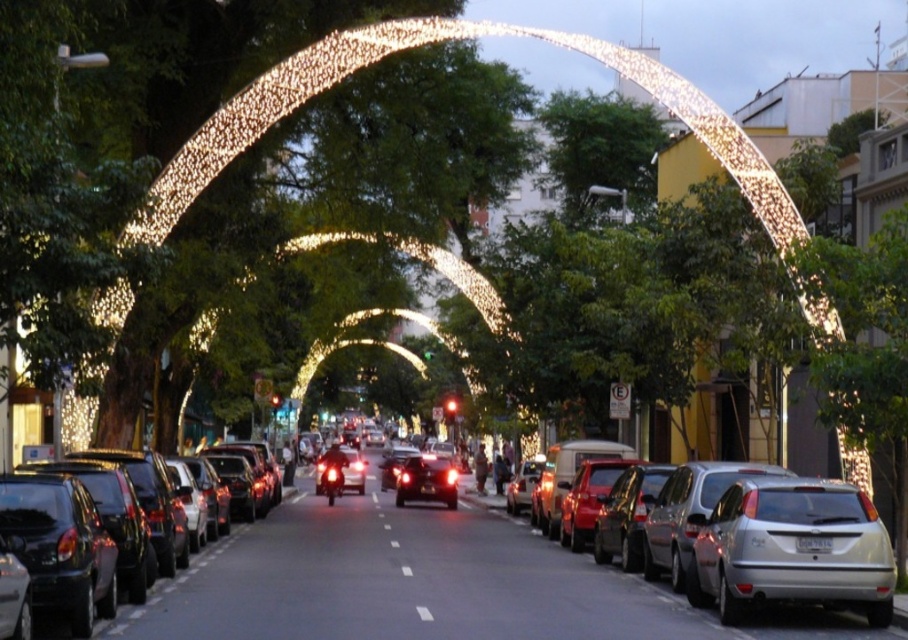
Question: Is the position of silver metallic sedan at center-right more distant than that of white dotted line at center?

Choices:
 (A) no
 (B) yes

Answer: (A)

Question: Observing the image, what is the correct spatial positioning of illuminated fabric arch at center in reference to white dotted line at center?

Choices:
 (A) right
 (B) left

Answer: (A)

Question: Is illuminated fabric arch at center to the right of silver metallic sedan at center-right from the viewer's perspective?

Choices:
 (A) no
 (B) yes

Answer: (B)

Question: Which object is closer to the camera taking this photo?

Choices:
 (A) matte black car at center
 (B) white dotted line at center
 (C) silver metallic sedan at center-right

Answer: (A)

Question: Among these objects, which one is nearest to the camera?

Choices:
 (A) silver metallic sedan at center-right
 (B) illuminated fabric arch at center
 (C) matte black car at center
 (D) white dotted line at center

Answer: (C)

Question: Which of the following is the farthest from the observer?

Choices:
 (A) silver metallic sedan at center-right
 (B) matte black car at center
 (C) white dotted line at center
 (D) illuminated fabric arch at center

Answer: (D)